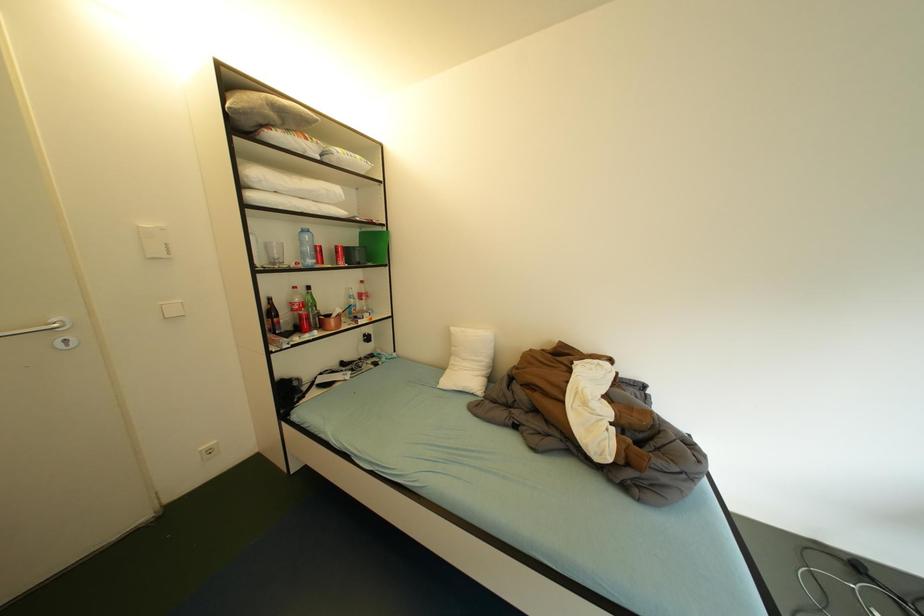
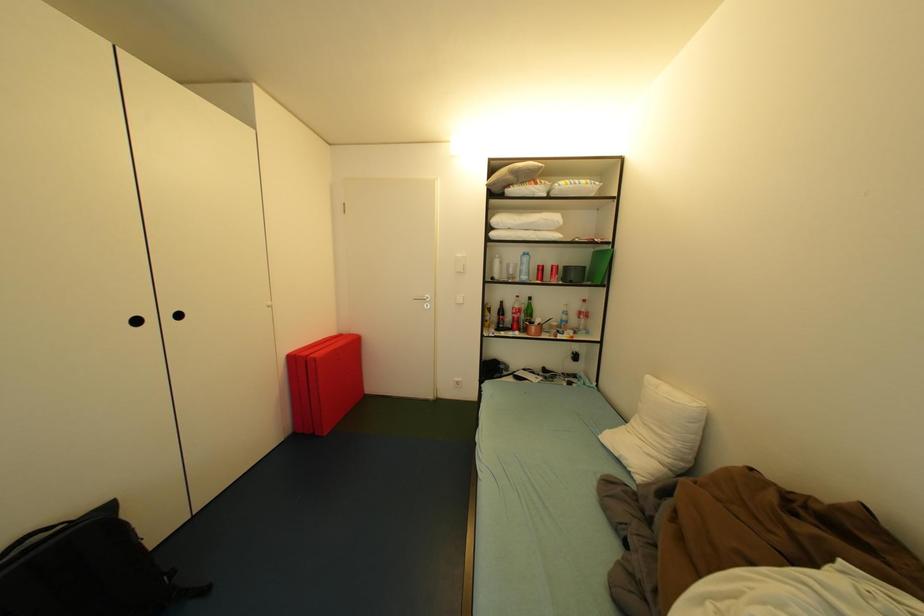
Question: Based on the continuous images, in which direction is the camera rotating? Reply with the corresponding letter.

Choices:
 (A) Left
 (B) Right
 (C) Up
 (D) Down

Answer: (A)